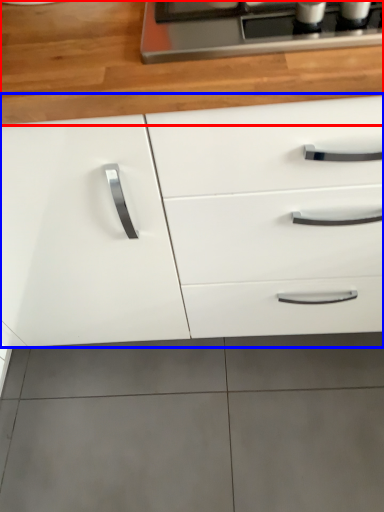
Question: Which point is closer to the camera, countertop (highlighted by a red box) or cabinetry (highlighted by a blue box)?

Choices:
 (A) countertop
 (B) cabinetry

Answer: (B)